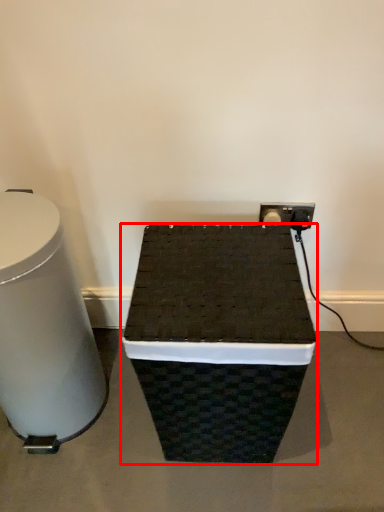
Question: From the image's perspective, what is the correct spatial relationship of furniture (annotated by the red box) in relation to table?

Choices:
 (A) below
 (B) above

Answer: (A)